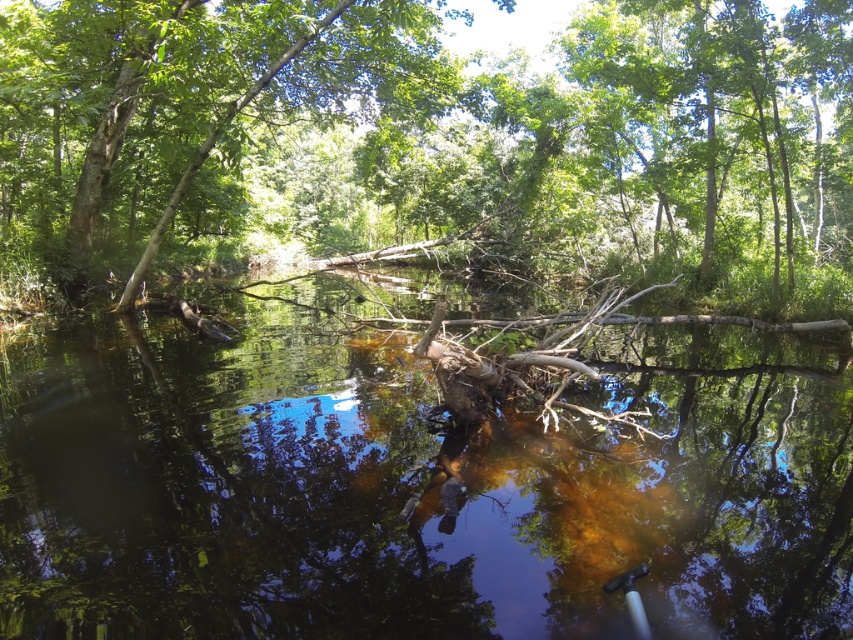
Is point (476, 580) behind point (583, 115)?

No.

This screenshot has height=640, width=853. Identify the location of brown murky water at center. click(x=413, y=484).

Identify the location of brown murky water at center. The width and height of the screenshot is (853, 640). (413, 484).